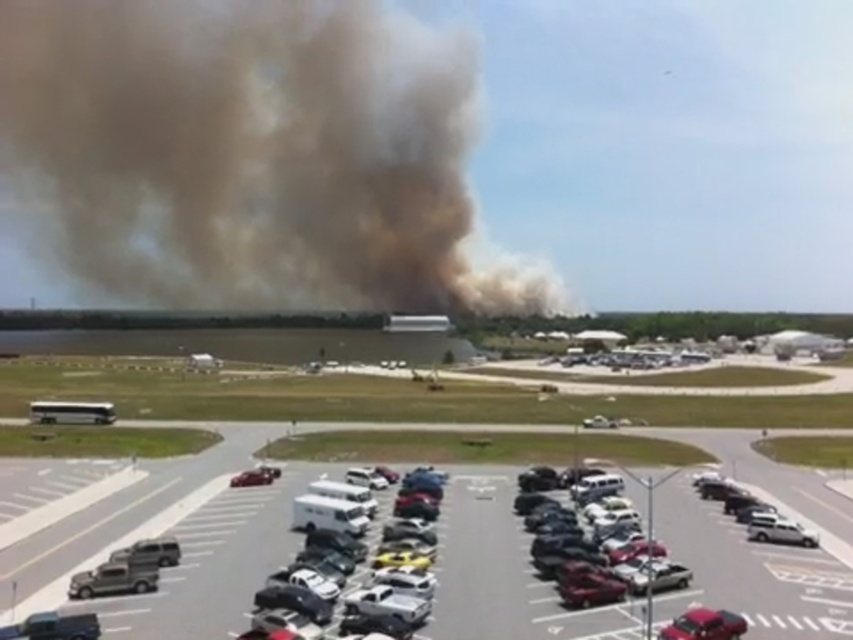
Question: Which of the following is the farthest from the observer?

Choices:
 (A) (167, 563)
 (B) (258, 477)

Answer: (B)

Question: Is the position of metallic silver car at center less distant than that of silver metallic bus at left?

Choices:
 (A) no
 (B) yes

Answer: (B)

Question: Can you confirm if brown dusty cloud at upper left is bigger than white matte van at center?

Choices:
 (A) yes
 (B) no

Answer: (A)

Question: Among these points, which one is nearest to the camera?

Choices:
 (A) (331, 166)
 (B) (584, 419)
 (C) (120, 612)
 (D) (328, 484)

Answer: (C)

Question: Is silver metallic bus at left below white matte truck at center?

Choices:
 (A) yes
 (B) no

Answer: (B)

Question: Which object appears closest to the camera in this image?

Choices:
 (A) shiny red car at lower right
 (B) metallic silver suv at lower left

Answer: (A)